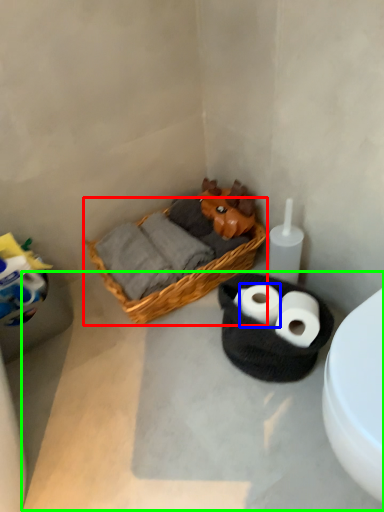
Question: Considering the real-world distances, which object is farthest from picnic basket (highlighted by a red box)? toilet paper (highlighted by a blue box) or concrete (highlighted by a green box)?

Choices:
 (A) toilet paper
 (B) concrete

Answer: (A)